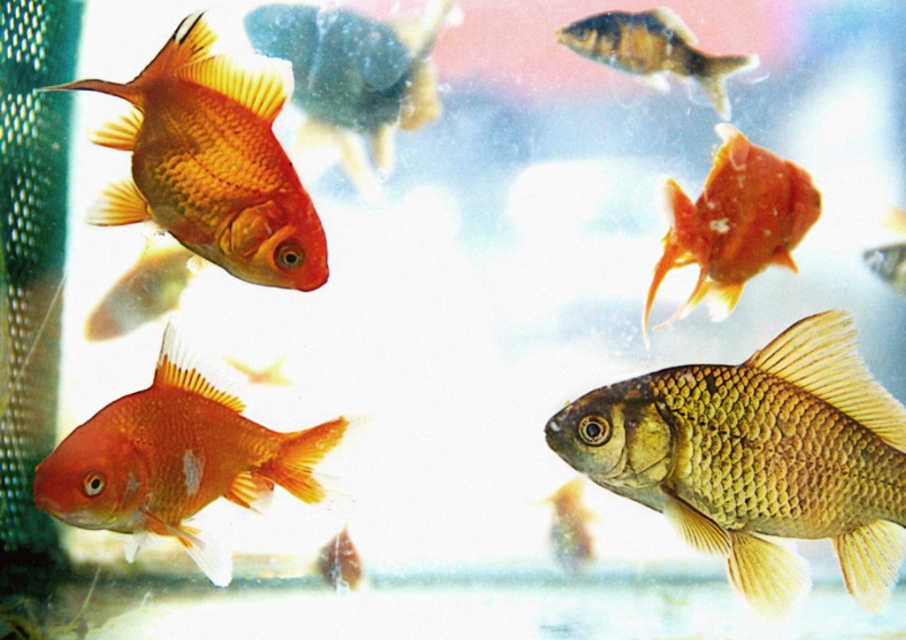
You are a new goldfish in the tank and want to swim to the shiny orange goldfish at upper right. Which direction should you swim from the matte goldfish at left?

The matte goldfish at left is to the left of the shiny orange goldfish at upper right, so you should swim to the right to reach the shiny orange goldfish at upper right.

You are a new fish in the tank and want to swim from the bottom to the top. Which fish will you pass first, the matte orange goldfish at lower left or the brown textured fish at upper center?

You will pass the matte orange goldfish at lower left first because it is located at the lower left position, closer to the bottom of the tank compared to the brown textured fish at upper center which is higher up.